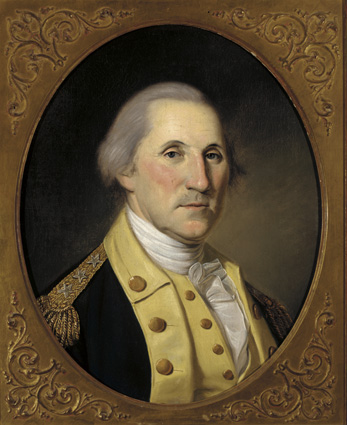
I want to click on portrait style painting, so click(x=332, y=260).